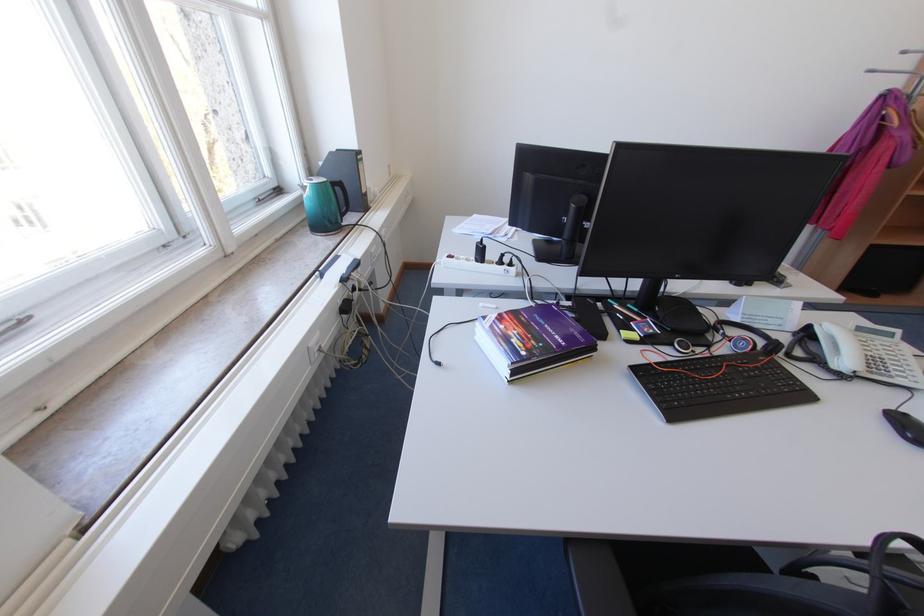
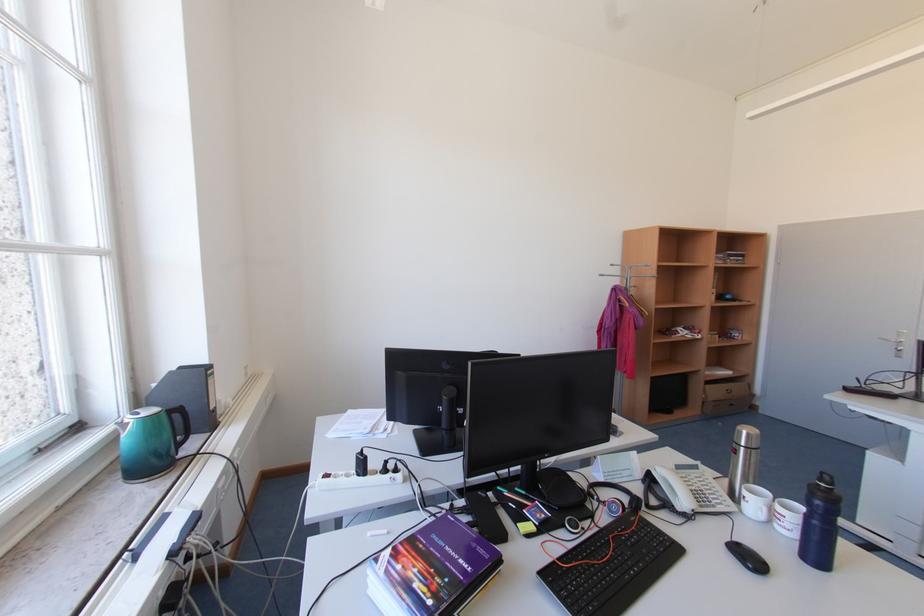
In the second image, find the point that corresponds to (346,190) in the first image.

(185, 416)